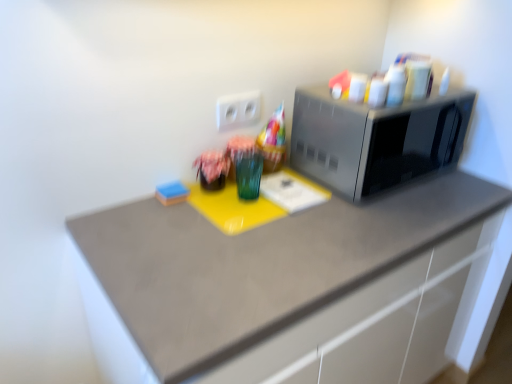
Question: In the image, is blue sponge at lower left on the left side or the right side of matte fabric flower at center?

Choices:
 (A) left
 (B) right

Answer: (A)

Question: Considering the positions of blue sponge at lower left and matte fabric flower at center in the image, is blue sponge at lower left wider or thinner than matte fabric flower at center?

Choices:
 (A) thin
 (B) wide

Answer: (A)

Question: Which object is the closest to the satin silver microwave at right?

Choices:
 (A) matte gray countertop at center
 (B) blue sponge at lower left
 (C) white plastic electric outlet at center
 (D) green glass at center
 (E) matte fabric flower at center

Answer: (A)

Question: Which of these objects is positioned closest to the satin silver microwave at right?

Choices:
 (A) green glass at center
 (B) matte fabric flower at center
 (C) matte gray countertop at center
 (D) blue sponge at lower left
 (E) white plastic electric outlet at center

Answer: (C)